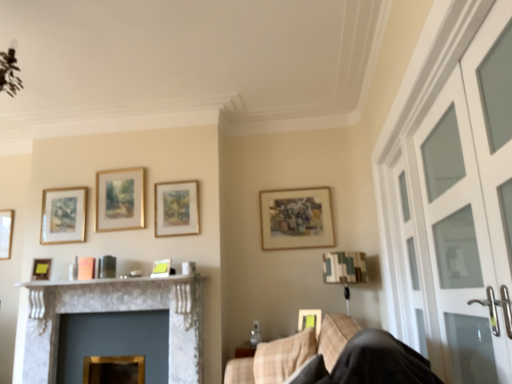
Where is `free space above white frosted glass screen door at right, the first screen door in the front-to-back sequence (from a real-world perspective)`? This screenshot has width=512, height=384. free space above white frosted glass screen door at right, the first screen door in the front-to-back sequence (from a real-world perspective) is located at coordinates (430, 94).